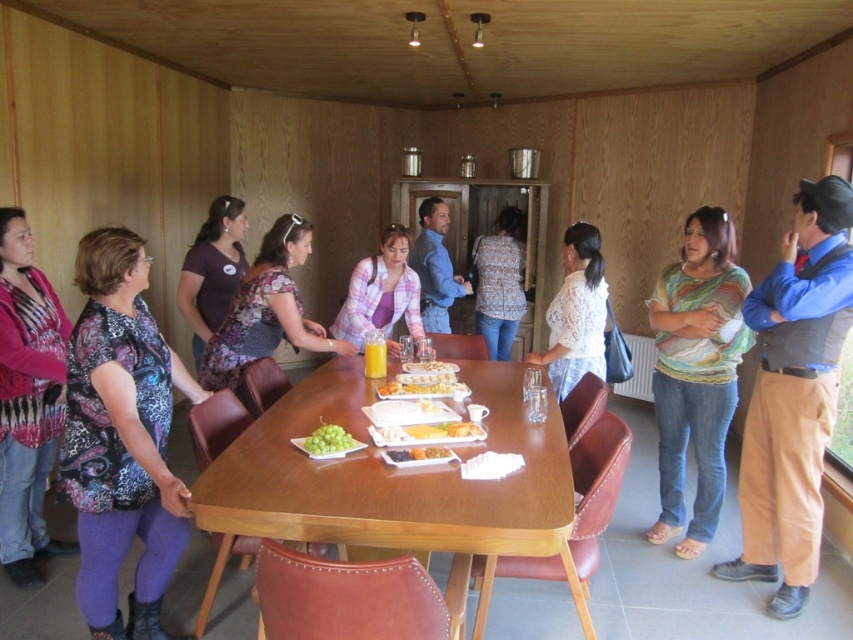
Question: Which of these objects is positioned closest to the white glossy plate at center?

Choices:
 (A) printed fabric blouse at lower left
 (B) pink fabric shirt at center

Answer: (B)

Question: Does wooden table at center have a lesser width compared to pink fabric shirt at center?

Choices:
 (A) yes
 (B) no

Answer: (B)

Question: Can you confirm if brown leather pants at right is smaller than printed fabric blouse at lower left?

Choices:
 (A) yes
 (B) no

Answer: (B)

Question: Among these points, which one is nearest to the camera?

Choices:
 (A) (764, 572)
 (B) (316, 440)
 (C) (515, 260)

Answer: (B)

Question: Considering the real-world distances, which object is farthest from the purple fabric shirt at center?

Choices:
 (A) floral fabric blouse at center
 (B) green matte grapes at center
 (C) blue denim jeans at center

Answer: (B)

Question: Can you confirm if smooth plastic tray at center is wider than white glossy plate at center?

Choices:
 (A) no
 (B) yes

Answer: (B)